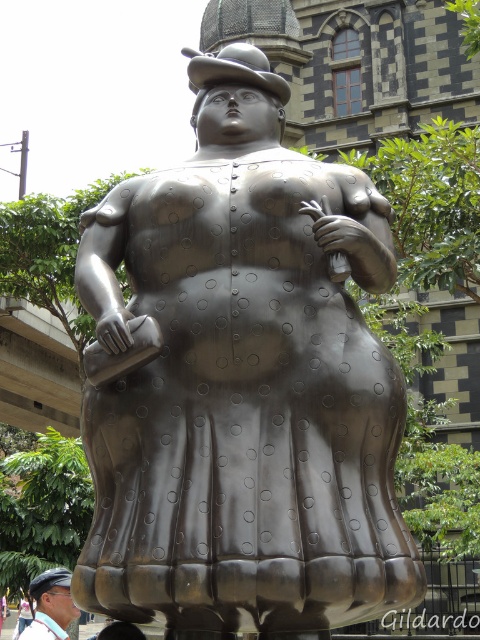
Does bronze/statue at center lie behind matte black hat at lower left?

No.

In the scene shown: Which is more to the right, bronze/statue at center or matte black hat at lower left?

Positioned to the right is bronze/statue at center.

Who is more forward, (x=280, y=520) or (x=40, y=632)?

Point (x=280, y=520) is more forward.

The width and height of the screenshot is (480, 640). Find the location of `bronze/statue at center`. bronze/statue at center is located at coordinates (242, 385).